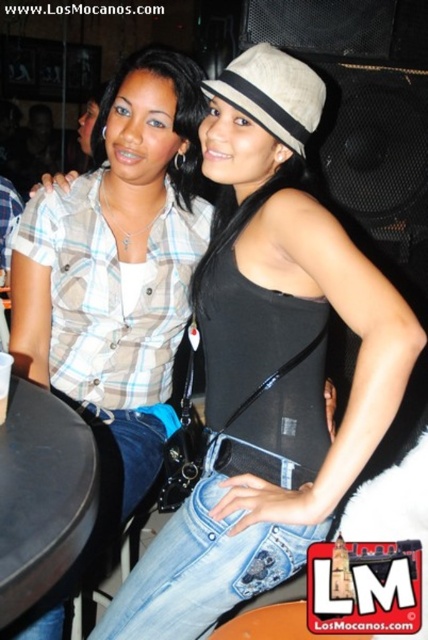
Question: Based on their relative distances, which object is nearer to the beige fabric hat at center?

Choices:
 (A) denim jeans at lower center
 (B) plaid shirt at left
 (C) black plastic table at lower left

Answer: (B)

Question: Among these objects, which one is nearest to the camera?

Choices:
 (A) plaid shirt at left
 (B) black plastic table at lower left
 (C) beige fabric hat at center
 (D) denim jeans at lower center

Answer: (B)

Question: Which of the following is the closest to the observer?

Choices:
 (A) plaid shirt at left
 (B) black plastic table at lower left
 (C) denim jeans at lower center
 (D) beige fabric hat at center

Answer: (B)

Question: Does black plastic table at lower left have a smaller size compared to beige fabric hat at center?

Choices:
 (A) no
 (B) yes

Answer: (A)

Question: Can you confirm if denim jeans at lower center is bigger than black plastic table at lower left?

Choices:
 (A) yes
 (B) no

Answer: (A)

Question: Can you confirm if denim jeans at lower center is wider than beige fabric hat at center?

Choices:
 (A) yes
 (B) no

Answer: (A)